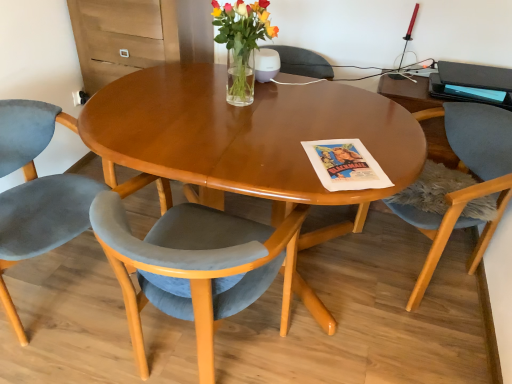
Question: From the image's perspective, is velvet grey chair at lower left, placed as the second chair when sorted from right to left, on velvet grey chair at lower left, which is the 1th chair in left-to-right order?

Choices:
 (A) no
 (B) yes

Answer: (A)

Question: Does velvet grey chair at lower left, acting as the 2th chair starting from the left, have a larger size compared to velvet grey chair at lower left, which is the 1th chair in left-to-right order?

Choices:
 (A) yes
 (B) no

Answer: (A)

Question: Is velvet grey chair at lower left, acting as the 2th chair starting from the left, not within velvet grey chair at lower left, the third chair viewed from the right?

Choices:
 (A) yes
 (B) no

Answer: (A)

Question: Is velvet grey chair at lower left, which is the 1th chair in left-to-right order, a part of velvet grey chair at lower left, acting as the 2th chair starting from the left?

Choices:
 (A) no
 (B) yes

Answer: (A)

Question: Considering the relative positions of velvet grey chair at lower left, placed as the second chair when sorted from right to left, and velvet grey chair at lower left, which is the 1th chair in left-to-right order, in the image provided, is velvet grey chair at lower left, placed as the second chair when sorted from right to left, to the left of velvet grey chair at lower left, which is the 1th chair in left-to-right order, from the viewer's perspective?

Choices:
 (A) yes
 (B) no

Answer: (B)

Question: In the image, is translucent glass vase at center on the left side or the right side of velvet grey chair at lower left, placed as the second chair when sorted from right to left?

Choices:
 (A) right
 (B) left

Answer: (A)

Question: Is translucent glass vase at center in front of or behind velvet grey chair at lower left, acting as the 2th chair starting from the left, in the image?

Choices:
 (A) behind
 (B) front

Answer: (A)

Question: Considering the positions of point (256, 31) and point (280, 235), is point (256, 31) closer or farther from the camera than point (280, 235)?

Choices:
 (A) closer
 (B) farther

Answer: (B)

Question: Considering the positions of translucent glass vase at center and velvet grey chair at lower left, placed as the second chair when sorted from right to left, in the image, is translucent glass vase at center bigger or smaller than velvet grey chair at lower left, placed as the second chair when sorted from right to left,?

Choices:
 (A) small
 (B) big

Answer: (A)

Question: From the image's perspective, is velvet grey chair at lower left, which is the 1th chair in left-to-right order, located above or below velvet grey chair at lower left, placed as the second chair when sorted from right to left?

Choices:
 (A) below
 (B) above

Answer: (B)

Question: Is velvet grey chair at lower left, the third chair viewed from the right, bigger or smaller than velvet grey chair at lower left, acting as the 2th chair starting from the left?

Choices:
 (A) small
 (B) big

Answer: (A)

Question: Looking at their shapes, would you say velvet grey chair at lower left, the third chair viewed from the right, is wider or thinner than velvet grey chair at lower left, acting as the 2th chair starting from the left?

Choices:
 (A) thin
 (B) wide

Answer: (B)

Question: From a real-world perspective, is velvet grey chair at lower left, the third chair viewed from the right, positioned above or below velvet grey chair at lower left, placed as the second chair when sorted from right to left?

Choices:
 (A) above
 (B) below

Answer: (B)

Question: From a real-world perspective, relative to matte black magazine at upper right, is velvet grey chair at lower left, placed as the second chair when sorted from right to left, vertically above or below?

Choices:
 (A) above
 (B) below

Answer: (B)

Question: Is velvet grey chair at lower left, acting as the 2th chair starting from the left, bigger or smaller than matte black magazine at upper right?

Choices:
 (A) small
 (B) big

Answer: (B)